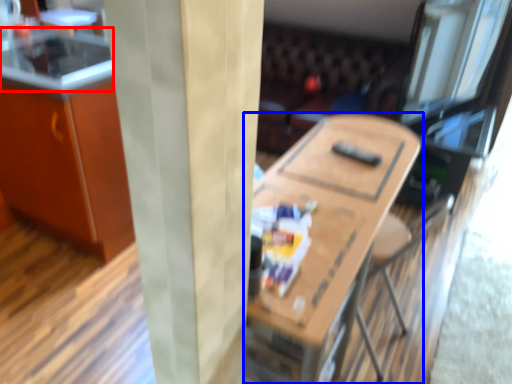
Question: Which object appears closest to the camera in this image, counter top (highlighted by a red box) or table (highlighted by a blue box)?

Choices:
 (A) counter top
 (B) table

Answer: (B)